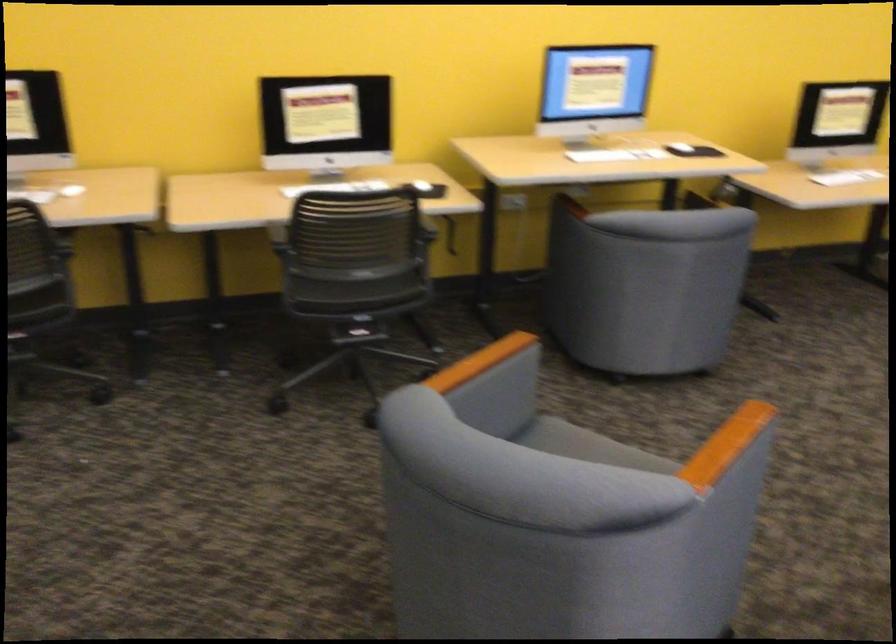
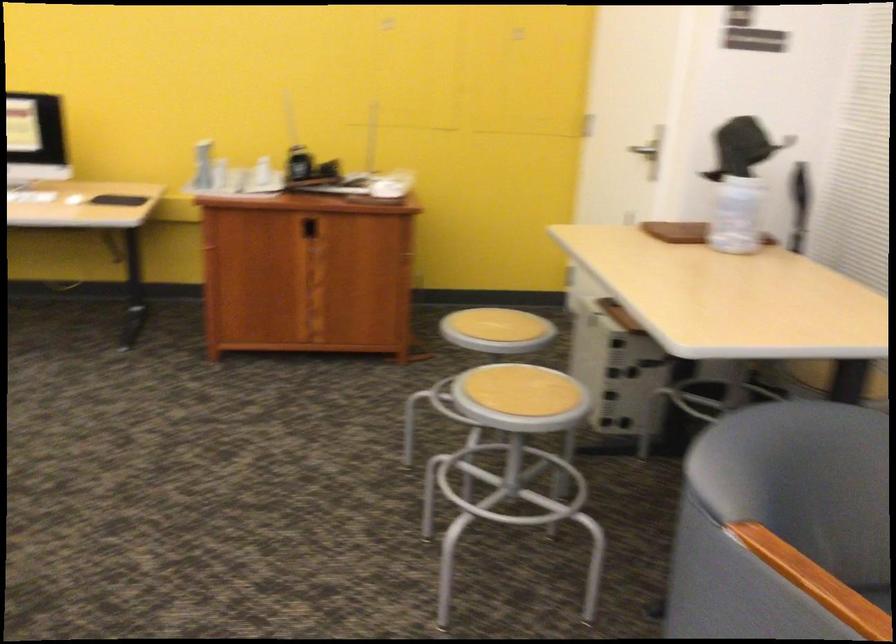
Question: In a continuous first-person perspective shot, in which direction is the camera moving?

Choices:
 (A) Left
 (B) Right
 (C) Forward
 (D) Backward

Answer: (B)